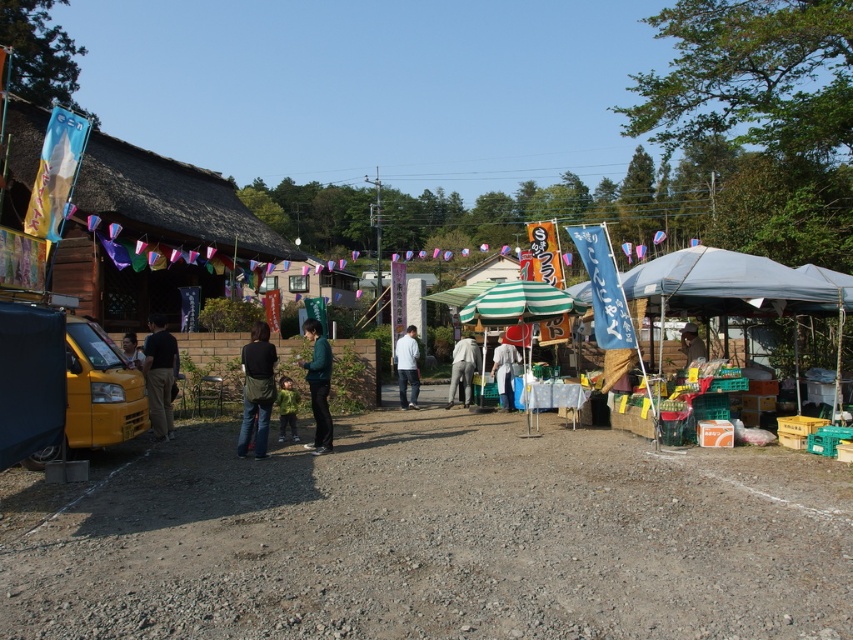
Who is more forward, [405,364] or [280,435]?

Positioned in front is point [280,435].

Does white matte shirt at center appear under green fuzzy jacket at center?

No, white matte shirt at center is not below green fuzzy jacket at center.

Which is behind, point (405, 376) or point (292, 417)?

Positioned behind is point (405, 376).

I want to click on white matte shirt at center, so click(407, 368).

Can you confirm if dark green sweater at center is taller than wooden chair at center?

Correct, dark green sweater at center is much taller as wooden chair at center.

Who is positioned more to the left, dark green sweater at center or wooden chair at center?

dark green sweater at center

You are a GUI agent. You are given a task and a screenshot of the screen. Output one action in this format:
    pyautogui.click(x=<x>, y=<y>)
    Task: Click on the dark green sweater at center
    This screenshot has height=640, width=853.
    Given the screenshot: What is the action you would take?
    pyautogui.click(x=318, y=387)

Find the location of a particular element. Image resolution: width=853 pixels, height=640 pixels. dark green sweater at center is located at coordinates point(318,387).

In the scene shown: Is dark green sweater at center below light gray fabric pants at center?

No.

Which is behind, point (309, 362) or point (456, 381)?

The point (456, 381) is behind.

This screenshot has height=640, width=853. What do you see at coordinates (318, 387) in the screenshot?
I see `dark green sweater at center` at bounding box center [318, 387].

Locate an element on the screen. dark green sweater at center is located at coordinates (318, 387).